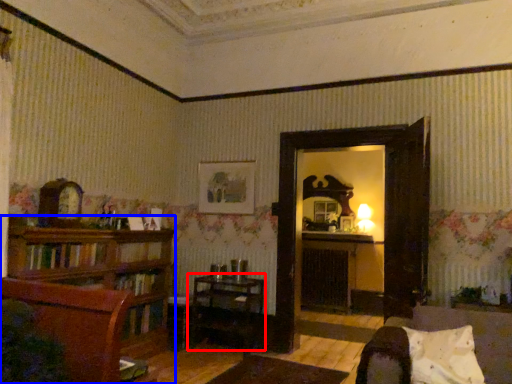
Question: Among these objects, which one is nearest to the camera, table (highlighted by a red box) or shelf (highlighted by a blue box)?

Choices:
 (A) table
 (B) shelf

Answer: (B)